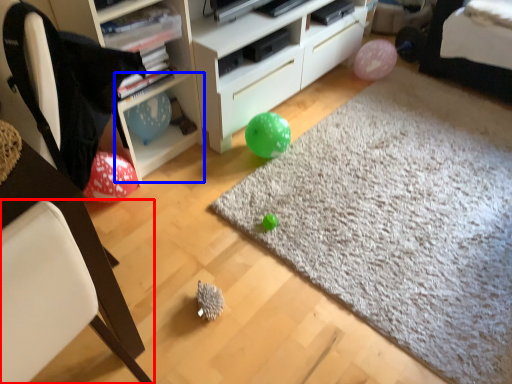
Question: Which point is closer to the camera, chair (highlighted by a red box) or cabinet (highlighted by a blue box)?

Choices:
 (A) chair
 (B) cabinet

Answer: (A)